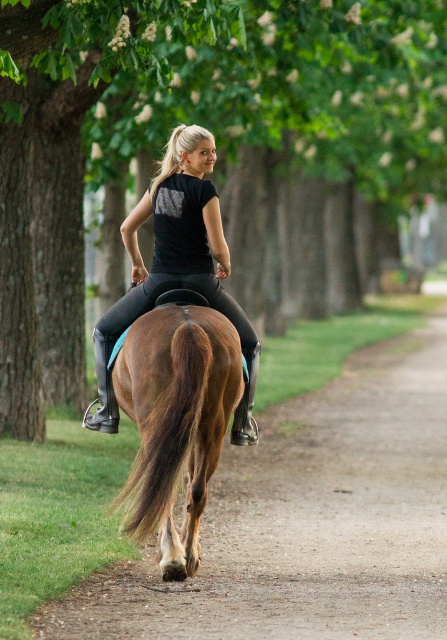
You are a photographer trying to capture the brown glossy horse at center and the black matte riding pants at center in a single shot. Based on their positions, which object should you focus on first if you want to ensure both are in sharp focus?

The brown glossy horse at center is located below the black matte riding pants at center. To ensure both are in sharp focus, you should focus on the black matte riding pants at center first since it is closer to the camera, and the depth of field will naturally include the horse below it.

You are a photographer trying to capture the scene. You want to ensure the brown glossy horse at center and the black matte riding pants at center are both visible in your shot. Based on their sizes, which one should you focus on to ensure both are in frame?

The brown glossy horse at center is not as tall as the black matte riding pants at center, so you should focus on the black matte riding pants at center to ensure both are in frame.